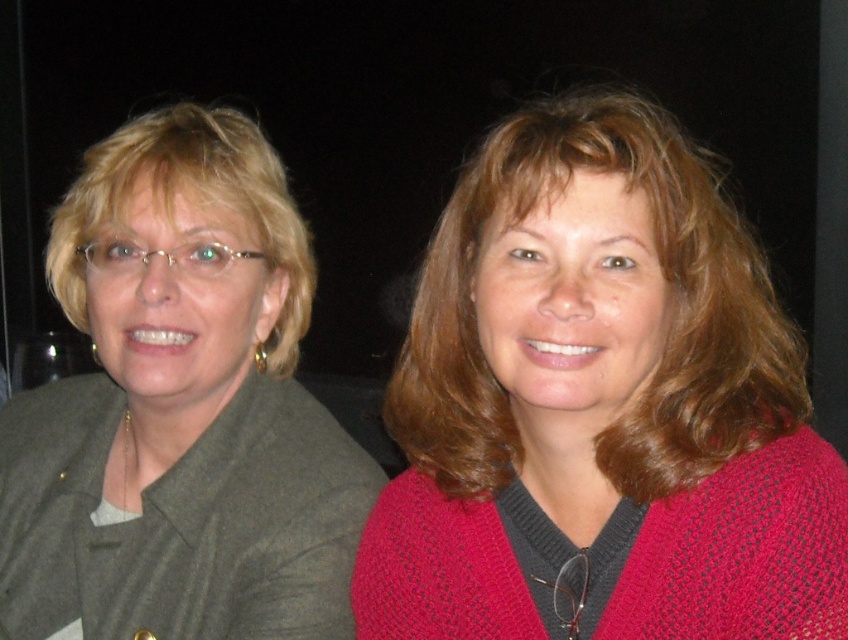
In the scene shown: You are organizing a clothing store and need to arrange these items vertically on a hanger rack. Given the current setup, where should you place the knitted pink sweater at center relative to the matte gray blazer at left?

The knitted pink sweater at center should be placed below the matte gray blazer at left as it is located below it.

You are a tailor who needs to determine which item is shorter in height between the knitted pink sweater at center and the matte gray blazer at left. Based on the scene, which one should you choose?

The knitted pink sweater at center has a lesser height compared to the matte gray blazer at left, so you should choose the knitted pink sweater at center.

You are trying to decide which piece of clothing to take for a casual day out. Based on the image, which item is bigger in size between the knitted pink sweater at center and the matte gray blazer at left?

The knitted pink sweater at center has a larger size compared to the matte gray blazer at left, so the knitted pink sweater at center is bigger in size.